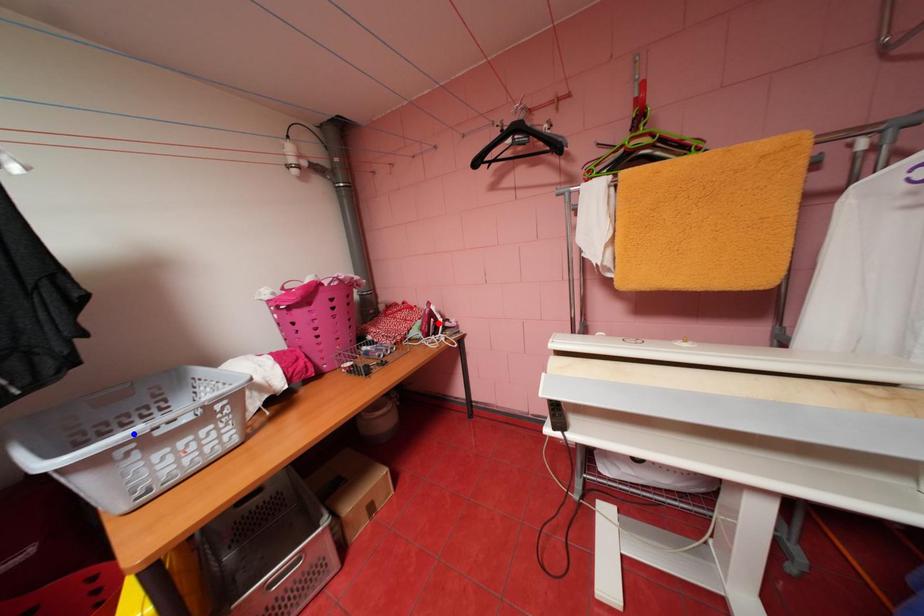
Question: Which of the two points in the image is closer to the camera?

Choices:
 (A) Blue point is closer.
 (B) Red point is closer.

Answer: (A)